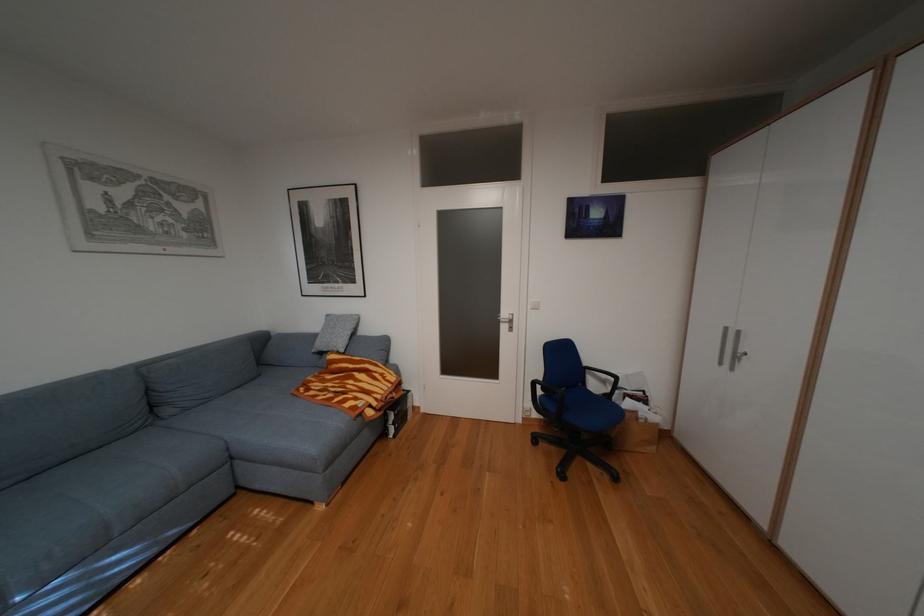
Find the location of a particular element. The width and height of the screenshot is (924, 616). blue sofa sitting surface is located at coordinates (136, 464).